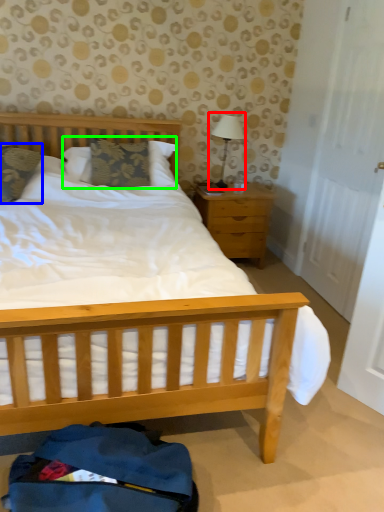
Question: Which object is the closest to the table lamp (highlighted by a red box)? Choose among these: pillow (highlighted by a blue box) or pillow (highlighted by a green box).

Choices:
 (A) pillow
 (B) pillow

Answer: (B)